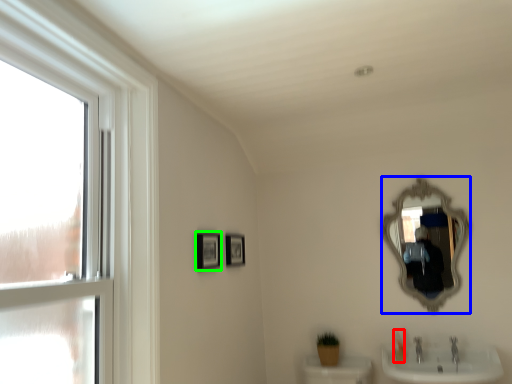
Question: Which object is positioned farthest from toiletry (highlighted by a red box)? Select from mirror (highlighted by a blue box) and picture frame (highlighted by a green box).

Choices:
 (A) mirror
 (B) picture frame

Answer: (B)